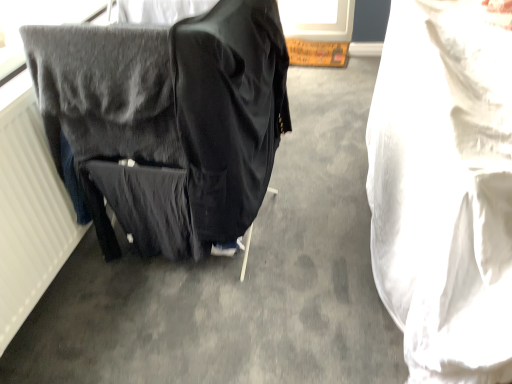
Question: Choose the correct answer: Is black fabric bag at left inside white fabric at right or outside it?

Choices:
 (A) inside
 (B) outside

Answer: (B)

Question: From the image's perspective, is black fabric bag at left above or below white fabric at right?

Choices:
 (A) above
 (B) below

Answer: (A)

Question: In terms of height, does black fabric bag at left look taller or shorter compared to white fabric at right?

Choices:
 (A) tall
 (B) short

Answer: (A)

Question: Is white fabric at right inside or outside of black fabric bag at left?

Choices:
 (A) outside
 (B) inside

Answer: (A)

Question: In the image, is white fabric at right on the left side or the right side of black fabric bag at left?

Choices:
 (A) right
 (B) left

Answer: (A)

Question: From a real-world perspective, relative to black fabric bag at left, is white fabric at right vertically above or below?

Choices:
 (A) below
 (B) above

Answer: (A)

Question: Considering the positions of point (449, 64) and point (106, 44), is point (449, 64) closer or farther from the camera than point (106, 44)?

Choices:
 (A) farther
 (B) closer

Answer: (A)